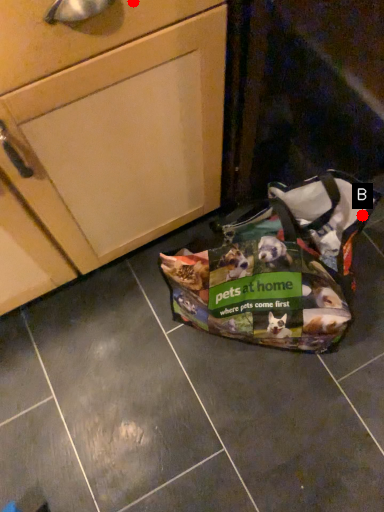
Question: Two points are circled on the image, labeled by A and B beside each circle. Which point is closer to the camera?

Choices:
 (A) A is closer
 (B) B is closer

Answer: (A)